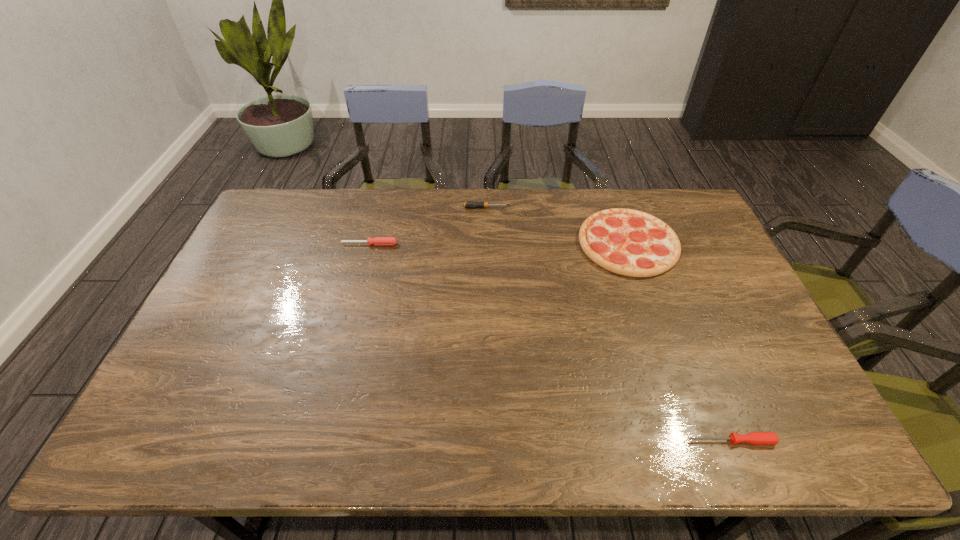
At what (x,y) coordinates should I click in order to perform the action: click on pizza. Please return your answer as a coordinate pair (x, y). Looking at the image, I should click on (628, 242).

Identify the location of the third object from right to left. The width and height of the screenshot is (960, 540). (469, 204).

Find the location of a particular element. The image size is (960, 540). the farthest object is located at coordinates (469, 204).

Locate an element on the screen. The height and width of the screenshot is (540, 960). the leftmost screwdriver is located at coordinates (377, 241).

Identify the location of the leftmost object. The height and width of the screenshot is (540, 960). (377, 241).

I want to click on the rightmost screwdriver, so click(x=755, y=438).

Where is `the nearest screwdriver`? Image resolution: width=960 pixels, height=540 pixels. the nearest screwdriver is located at coordinates (755, 438).

The height and width of the screenshot is (540, 960). Identify the location of blank area located on the back of the pizza. (611, 195).

Locate an element on the screen. The image size is (960, 540). vacant position located on the front of the second screwdriver from right to left is located at coordinates (487, 254).

Where is `vacant space located 0.110m on the front of the second nearest screwdriver`? The width and height of the screenshot is (960, 540). vacant space located 0.110m on the front of the second nearest screwdriver is located at coordinates (363, 271).